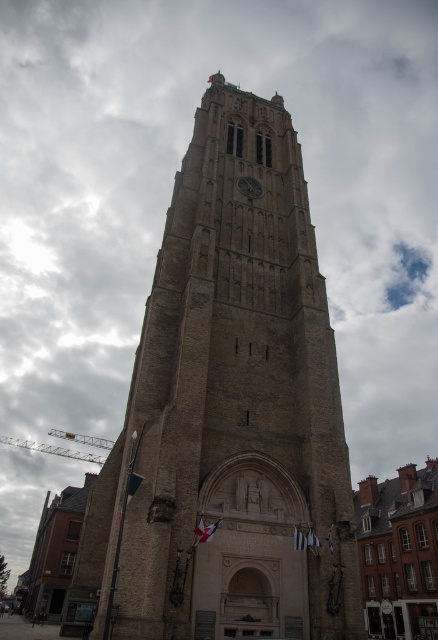
You are standing at the base of the brown stone tower at center and want to place a decorative plaque on the dark gray stone clock at center. The plaque has a 60 feet long ribbon attached to it. Will the ribbon be long enough to reach from the base of the tower to the clock?

The brown stone tower at center is 59.95 feet away from dark gray stone clock at center. The ribbon is 60 feet long, so it will be just long enough to reach from the base of the tower to the clock.

You are an architect analyzing the proportions of the brown stone tower at center and the dark gray stone clock at center. Which structure is taller?

The brown stone tower at center is taller than the dark gray stone clock at center.

You are standing in front of the brown stone tower at center. You want to take a photo of it with your smartphone. Considering the distance, will you be able to capture the entire tower in one frame without moving your phone?

The brown stone tower at center is 36.13 meters away from the camera. Since smartphones typically have wide angle lenses that can capture large structures at such distances, you should be able to include the entire tower in one frame without needing to move your phone.